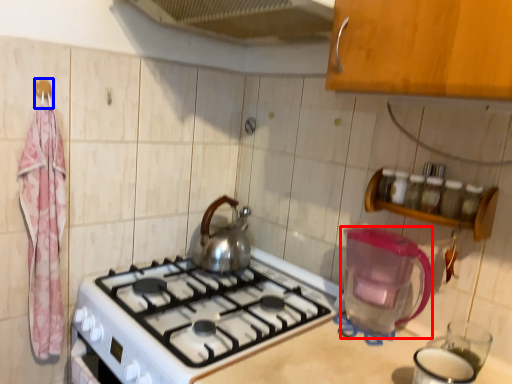
Question: Which object appears farthest to the camera in this image, appliance (highlighted by a red box) or hanger (highlighted by a blue box)?

Choices:
 (A) appliance
 (B) hanger

Answer: (B)